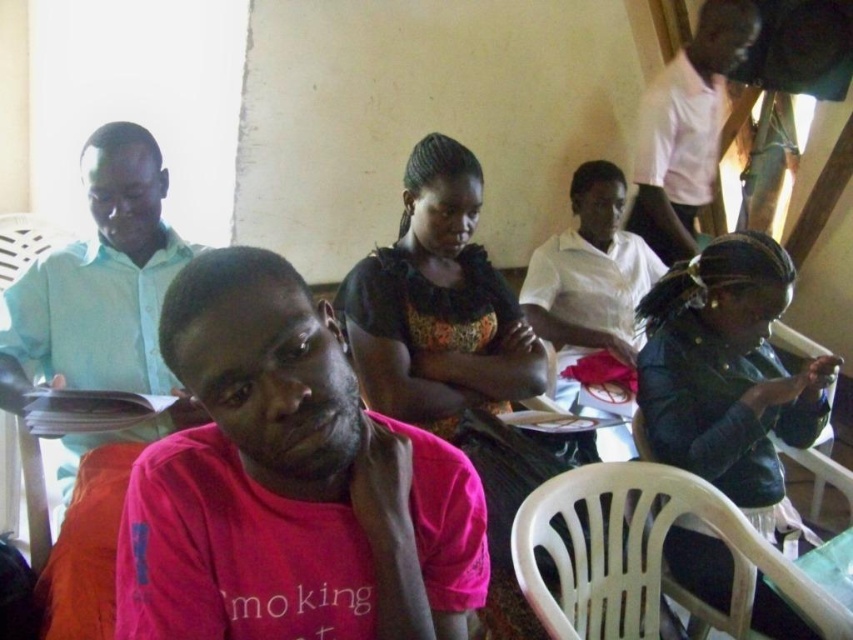
Based on the scene description, where is the light blue shirt at left located in terms of its 2D coordinates?

The light blue shirt at left is located at the 2D coordinates of point (102, 356).

In the scene, there are two people wearing the light blue shirt at left and the leather jacket at lower right. Which one is positioned more to the left side of the scene?

The light blue shirt at left is positioned more to the left side of the scene than the leather jacket at lower right.

You are organizing a small event and need to place a 30 inch wide decorative banner between the black floral dress at center and the green plastic table at lower right. Will there be enough space?

The black floral dress at center and green plastic table at lower right are 29.83 inches apart from each other, so the 30 inch wide decorative banner will not fit between them as the space is slightly smaller.